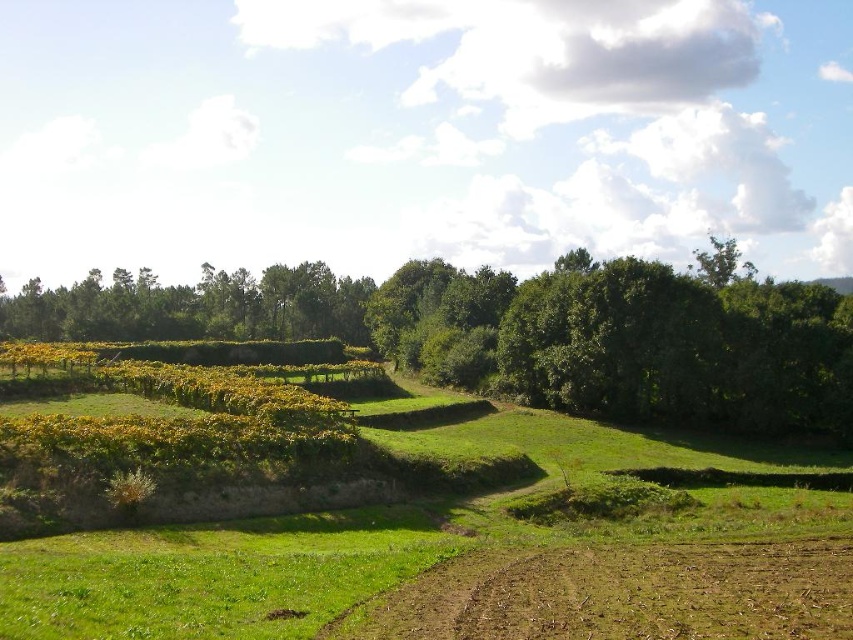
Question: Does green leafy tree at left appear on the right side of brown soil at lower center?

Choices:
 (A) no
 (B) yes

Answer: (A)

Question: Which point appears closest to the camera in this image?

Choices:
 (A) (825, 608)
 (B) (564, 321)

Answer: (A)

Question: Observing the image, what is the correct spatial positioning of green leafy tree at left in reference to brown soil at lower center?

Choices:
 (A) right
 (B) left

Answer: (B)

Question: Can you confirm if green leafy tree at left is positioned to the right of brown soil at lower center?

Choices:
 (A) no
 (B) yes

Answer: (A)